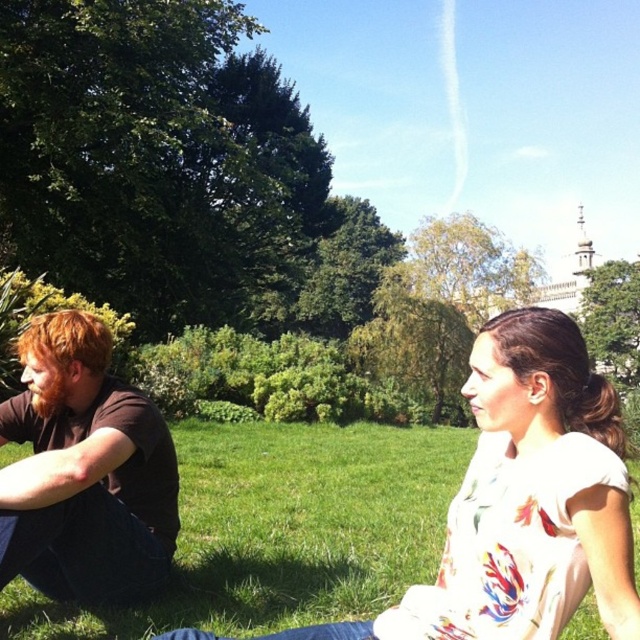
You are a photographer standing at a safe distance. You want to take a photo of both the white floral shirt at center and the brown cotton shirt at left. Given that your camera has a maximum zoom range of 10 meters, can you capture both subjects in a single frame without moving closer?

The distance between the white floral shirt at center and the brown cotton shirt at left is 14.14 meters. Since your camera can only zoom up to 10 meters, you cannot capture both subjects in a single frame without moving closer.